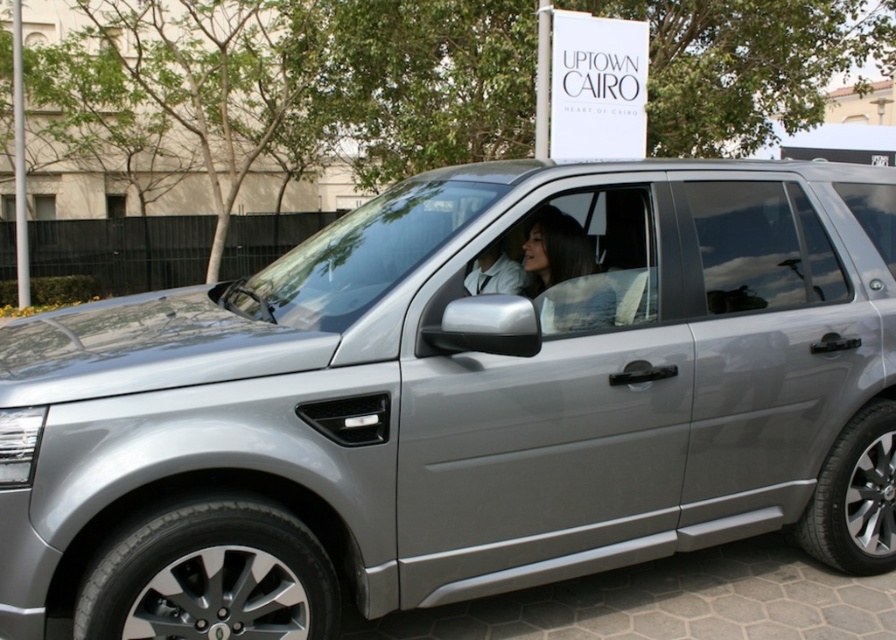
Question: Does smooth black hair at center have a larger size compared to transparent glass window at upper left?

Choices:
 (A) yes
 (B) no

Answer: (B)

Question: Among these objects, which one is farthest from the camera?

Choices:
 (A) transparent glass window at upper left
 (B) smooth black hair at center
 (C) light gray fabric shirt at center
 (D) transparent glass window at center

Answer: (A)

Question: Among these objects, which one is nearest to the camera?

Choices:
 (A) transparent glass window at center
 (B) light gray fabric shirt at center
 (C) transparent glass window at upper left

Answer: (B)

Question: Is transparent glass window at center bigger than smooth black hair at center?

Choices:
 (A) yes
 (B) no

Answer: (A)

Question: Does transparent glass window at center lie in front of transparent glass window at upper left?

Choices:
 (A) no
 (B) yes

Answer: (B)

Question: Estimate the real-world distances between objects in this image. Which object is farther from the transparent glass window at center?

Choices:
 (A) smooth black hair at center
 (B) light gray fabric shirt at center

Answer: (B)